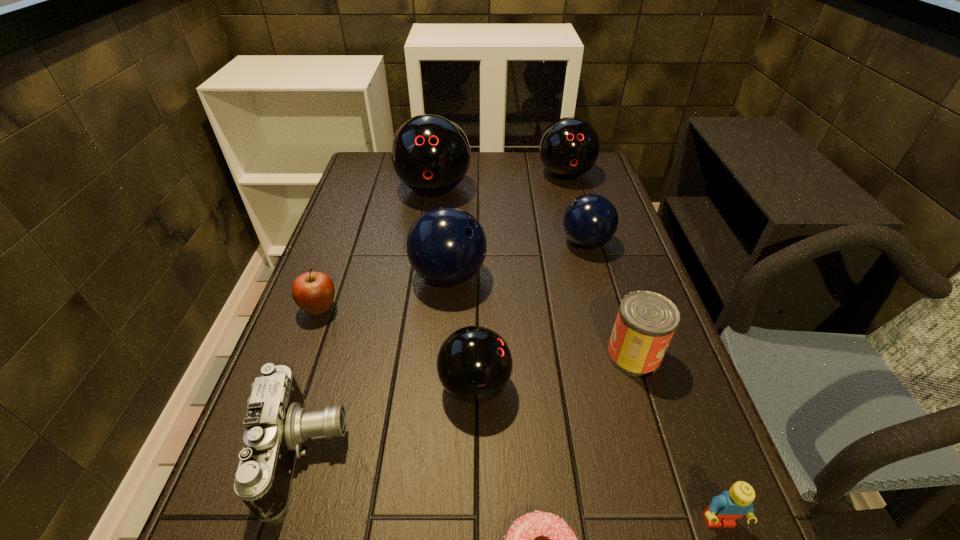
Image resolution: width=960 pixels, height=540 pixels. Identify the location of blue Lego. (725, 508).

This screenshot has width=960, height=540. I want to click on vacant space located 0.090m on the surface of the tallest object near the finger holes, so click(428, 228).

Where is `free spot located 0.280m on the surface of the second smallest black bowling ball near the finger holes`? free spot located 0.280m on the surface of the second smallest black bowling ball near the finger holes is located at coordinates point(585,245).

At what (x,y) coordinates should I click in order to perform the action: click on free space located 0.320m on the surface of the bigger blue bowling ball near the finger holes. Please return your answer as a coordinate pair (x, y). Looking at the image, I should click on (612, 276).

You are a GUI agent. You are given a task and a screenshot of the screen. Output one action in this format:
    pyautogui.click(x=<x>, y=<y>)
    Task: Click on the free space located on the surface of the right blue bowling ball near the finger holes
    
    Given the screenshot: What is the action you would take?
    pyautogui.click(x=429, y=242)

Where is `free space located 0.270m on the surface of the right blue bowling ball near the finger holes`? This screenshot has height=540, width=960. free space located 0.270m on the surface of the right blue bowling ball near the finger holes is located at coordinates pos(462,242).

Where is `vacant point located 0.270m on the surface of the right blue bowling ball near the finger holes`? The image size is (960, 540). vacant point located 0.270m on the surface of the right blue bowling ball near the finger holes is located at coordinates (462, 242).

The image size is (960, 540). Identify the location of vacant space located 0.230m on the surface of the smallest black bowling ball near the finger holes. click(x=626, y=386).

Find the location of a particular element. The image size is (960, 540). vacant space positioned 0.310m on the back of the can is located at coordinates (600, 247).

At what (x,y) coordinates should I click in order to perform the action: click on vacant space positioned 0.220m at the lens of the camera. Please return your answer as a coordinate pair (x, y). The width and height of the screenshot is (960, 540). Looking at the image, I should click on (471, 452).